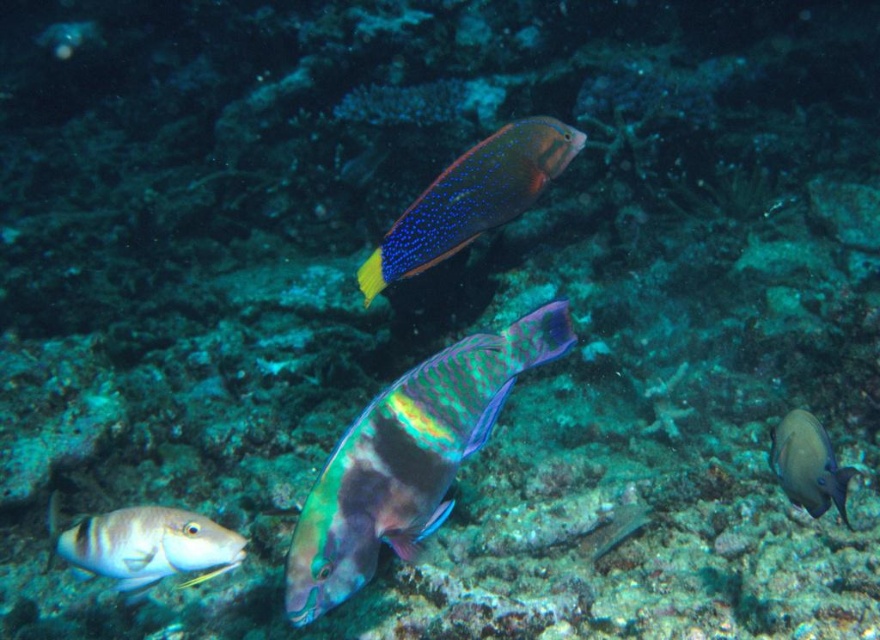
Which is above, shiny iridescent fish at center or smooth gray fish at lower right?

shiny iridescent fish at center

Is shiny iridescent fish at center further to camera compared to smooth gray fish at lower right?

That is False.

At what (x,y) coordinates should I click in order to perform the action: click on shiny iridescent fish at center. Please return your answer as a coordinate pair (x, y). This screenshot has width=880, height=640. Looking at the image, I should click on (408, 458).

Which of these two, shiny blue and yellow fish at upper center or shiny silver fish at lower left, stands taller?

Standing taller between the two is shiny blue and yellow fish at upper center.

Describe the element at coordinates (471, 198) in the screenshot. I see `shiny blue and yellow fish at upper center` at that location.

Locate an element on the screen. This screenshot has width=880, height=640. shiny blue and yellow fish at upper center is located at coordinates (471, 198).

From the picture: Measure the distance between shiny silver fish at lower left and camera.

A distance of 1.65 meters exists between shiny silver fish at lower left and camera.

Does shiny silver fish at lower left appear on the left side of smooth gray fish at lower right?

Indeed, shiny silver fish at lower left is positioned on the left side of smooth gray fish at lower right.

Is point (187, 532) closer to viewer compared to point (841, 472)?

No, it is not.

The width and height of the screenshot is (880, 640). Identify the location of shiny silver fish at lower left. (145, 545).